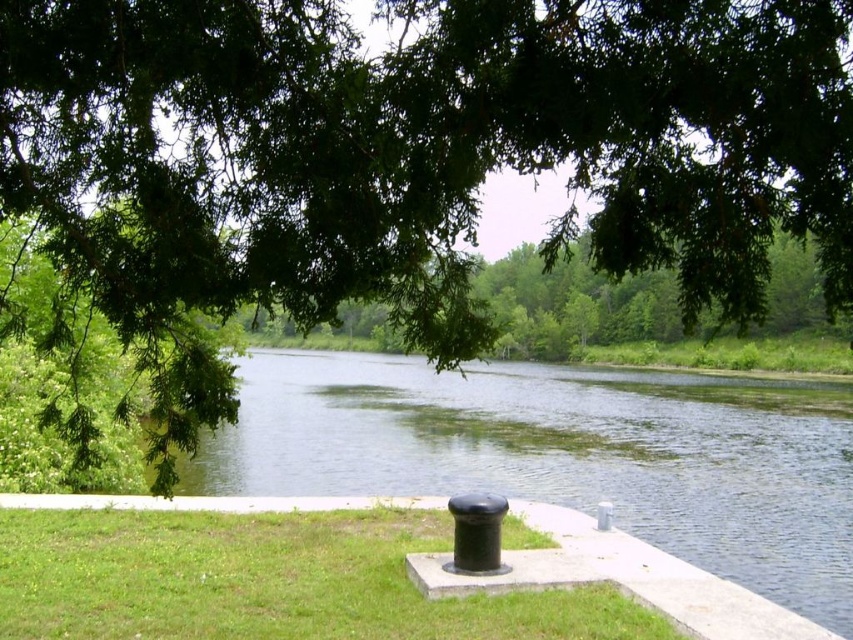
Can you confirm if green water at center is positioned to the left of green grass at center?

In fact, green water at center is to the right of green grass at center.

Who is more forward, (805, 513) or (654, 614)?

Point (654, 614) is more forward.

In order to click on green water at center in this screenshot , I will do (566, 454).